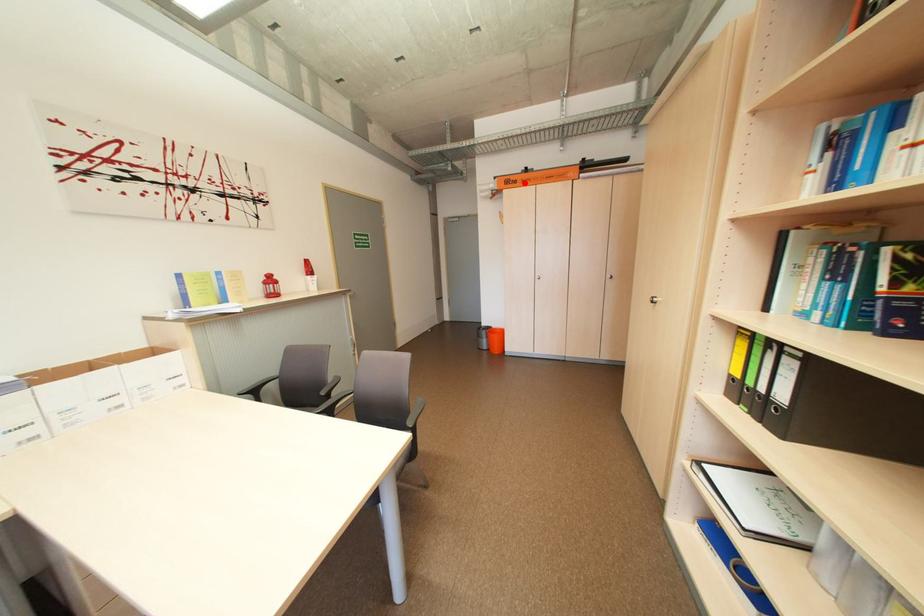
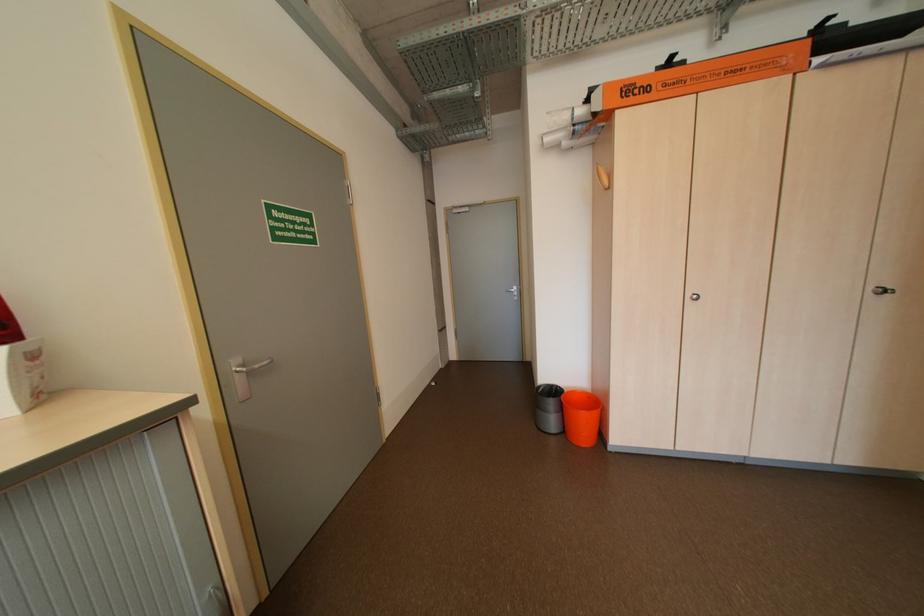
Question: I am providing you with two images of the same scene from different viewpoints. A red point is marked on the first image. Can you still see the location of the red point in image 2?

Choices:
 (A) Yes
 (B) No

Answer: (A)